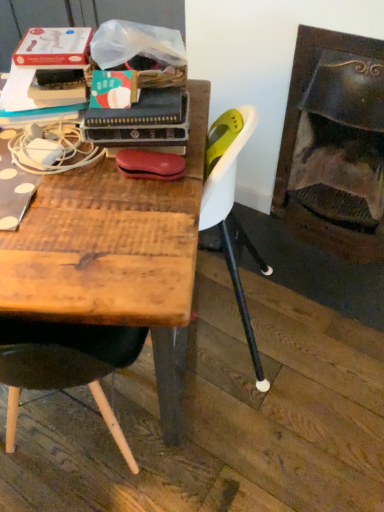
Locate an element on the screen. Image resolution: width=384 pixels, height=512 pixels. vacant space in front of dark brown wood fireplace at right is located at coordinates (323, 290).